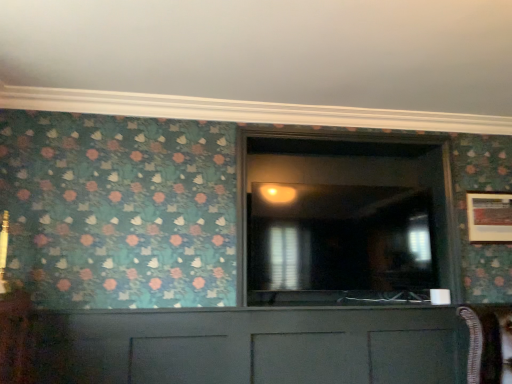
Question: Considering the relative sizes of matte gray cabinet at center and transparent glass door at center in the image provided, is matte gray cabinet at center taller than transparent glass door at center?

Choices:
 (A) no
 (B) yes

Answer: (A)

Question: From a real-world perspective, is matte gray cabinet at center physically below transparent glass door at center?

Choices:
 (A) yes
 (B) no

Answer: (A)

Question: Can you confirm if matte gray cabinet at center is bigger than transparent glass door at center?

Choices:
 (A) yes
 (B) no

Answer: (B)

Question: Is transparent glass door at center at the back of matte gray cabinet at center?

Choices:
 (A) no
 (B) yes

Answer: (A)

Question: Is matte gray cabinet at center located outside transparent glass door at center?

Choices:
 (A) yes
 (B) no

Answer: (A)

Question: Looking at their shapes, would you say wooden picture frame at right is wider or thinner than transparent glass door at center?

Choices:
 (A) thin
 (B) wide

Answer: (A)

Question: Does point (481, 235) appear closer or farther from the camera than point (297, 213)?

Choices:
 (A) closer
 (B) farther

Answer: (B)

Question: From their relative heights in the image, would you say wooden picture frame at right is taller or shorter than transparent glass door at center?

Choices:
 (A) tall
 (B) short

Answer: (B)

Question: From the image's perspective, is wooden picture frame at right positioned above or below transparent glass door at center?

Choices:
 (A) above
 (B) below

Answer: (B)

Question: From a real-world perspective, is transparent glass door at center above or below wooden picture frame at right?

Choices:
 (A) below
 (B) above

Answer: (B)

Question: In terms of width, does transparent glass door at center look wider or thinner when compared to wooden picture frame at right?

Choices:
 (A) thin
 (B) wide

Answer: (B)

Question: In terms of height, does transparent glass door at center look taller or shorter compared to wooden picture frame at right?

Choices:
 (A) tall
 (B) short

Answer: (A)

Question: Considering the relative positions of transparent glass door at center and wooden picture frame at right in the image provided, is transparent glass door at center to the left or to the right of wooden picture frame at right?

Choices:
 (A) left
 (B) right

Answer: (A)

Question: Is matte gray cabinet at center bigger or smaller than transparent glass door at center?

Choices:
 (A) small
 (B) big

Answer: (A)

Question: Is matte gray cabinet at center taller or shorter than transparent glass door at center?

Choices:
 (A) tall
 (B) short

Answer: (B)